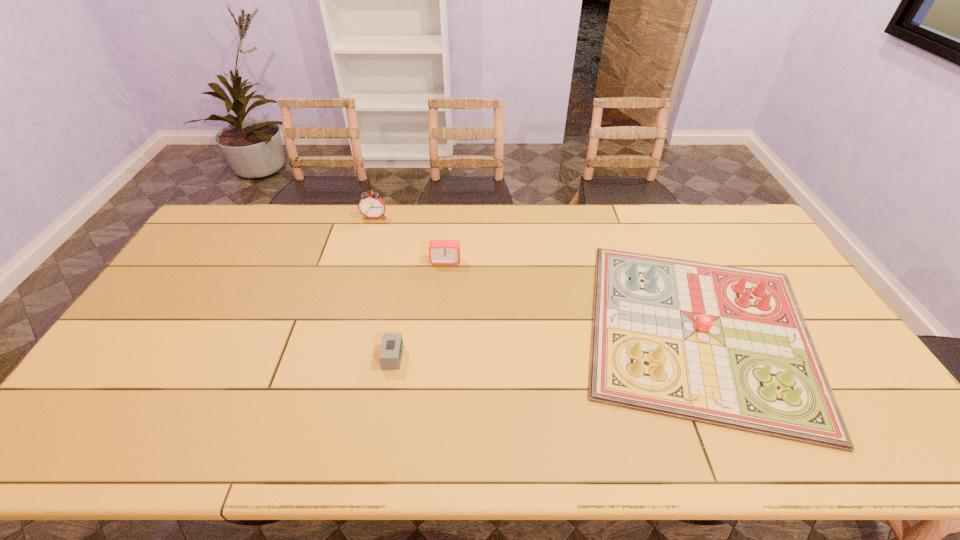
Locate an element on the screen. This screenshot has width=960, height=540. vacant region that satisfies the following two spatial constraints: 1. on the front-facing side of the rightmost object; 2. on the right side of the second nearest alarm clock is located at coordinates (440, 330).

You are a GUI agent. You are given a task and a screenshot of the screen. Output one action in this format:
    pyautogui.click(x=<x>, y=<y>)
    Task: Click on the vacant region that satisfies the following two spatial constraints: 1. on the clock face of the rightmost object; 2. on the right side of the tallest alarm clock
    The height and width of the screenshot is (540, 960).
    Given the screenshot: What is the action you would take?
    pyautogui.click(x=342, y=330)

Find the location of a particular element. The image size is (960, 540). vacant area in the image that satisfies the following two spatial constraints: 1. on the front-facing side of the second farthest alarm clock; 2. on the front-facing side of the second alarm clock from left to right is located at coordinates (438, 357).

Locate an element on the screen. free space that satisfies the following two spatial constraints: 1. on the clock face of the farthest alarm clock; 2. on the left side of the second shortest object is located at coordinates (342, 330).